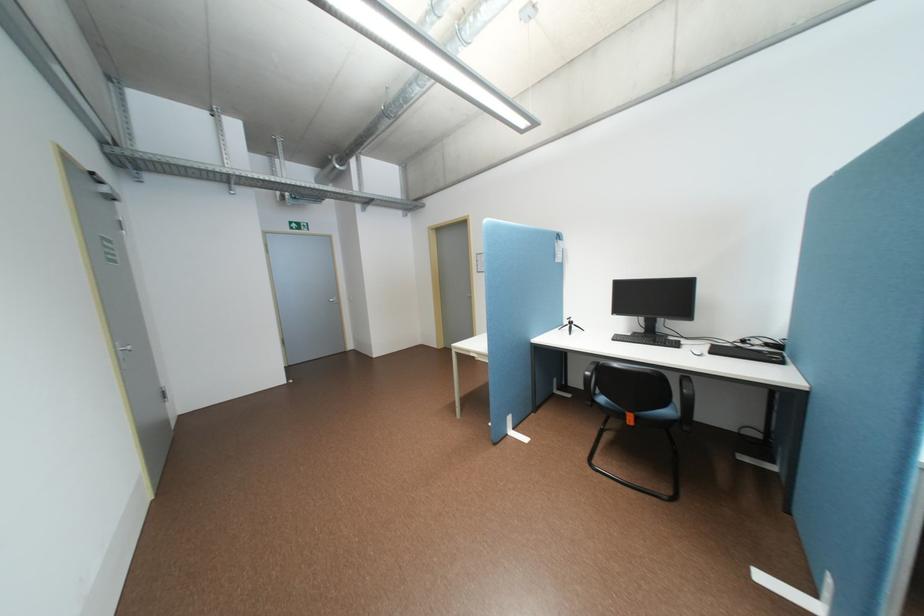
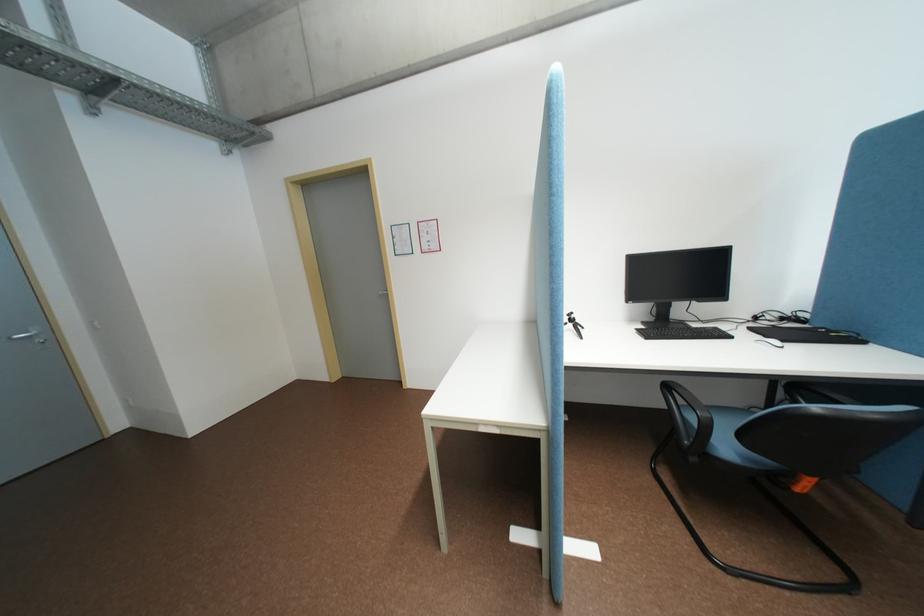
Question: What movement of the cameraman would produce the second image?

Choices:
 (A) Left
 (B) Right
 (C) Forward
 (D) Backward

Answer: (C)